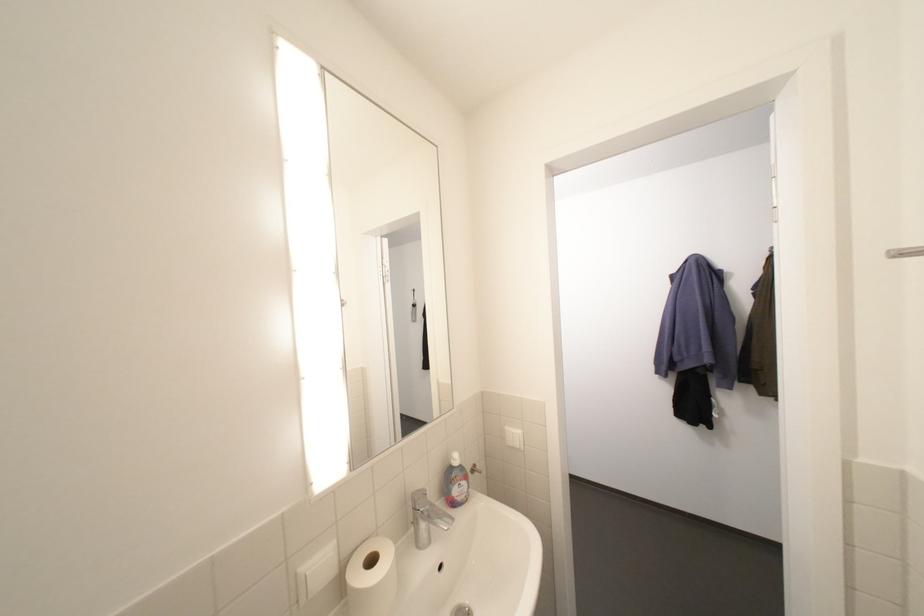
This screenshot has width=924, height=616. Identify the location of soap dispenser pump. (455, 482).